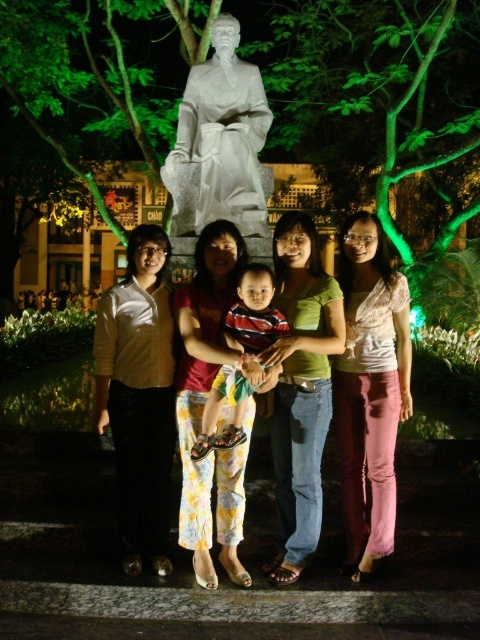
Based on the scene description, where exactly is the light pink cotton pants at center located in the image?

The light pink cotton pants at center is located at point coordinates of (370,387).

You are a photographer trying to adjust the lighting for a group photo. You notice two clothing items in the center of the image. Which clothing item is on the left side when looking at the satin gold blouse at center and the striped cotton shirt at center?

The satin gold blouse at center is positioned on the left side of the striped cotton shirt at center, so the satin gold blouse at center is on the left.